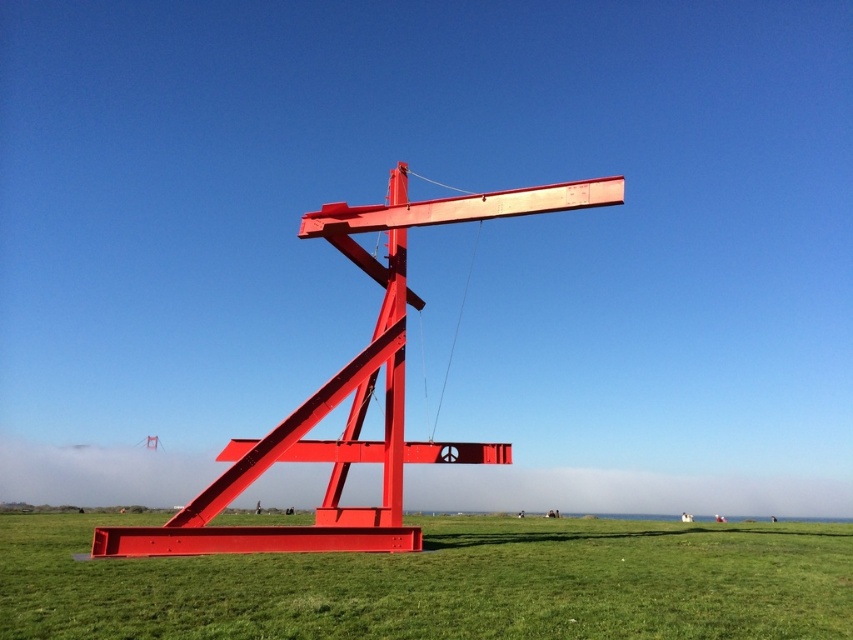
Question: Is the position of green grass at center less distant than that of metallic red sculpture at center?

Choices:
 (A) yes
 (B) no

Answer: (A)

Question: Is green grass at center closer to the viewer compared to metallic red sculpture at center?

Choices:
 (A) yes
 (B) no

Answer: (A)

Question: Among these objects, which one is farthest from the camera?

Choices:
 (A) green grass at center
 (B) metallic red sculpture at center

Answer: (B)

Question: Can you confirm if green grass at center is positioned to the right of metallic red sculpture at center?

Choices:
 (A) no
 (B) yes

Answer: (B)